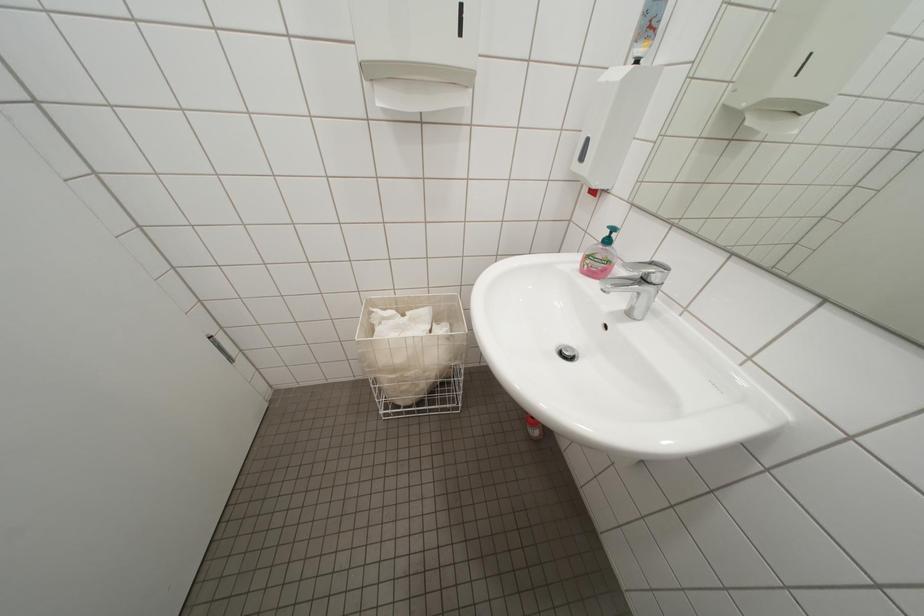
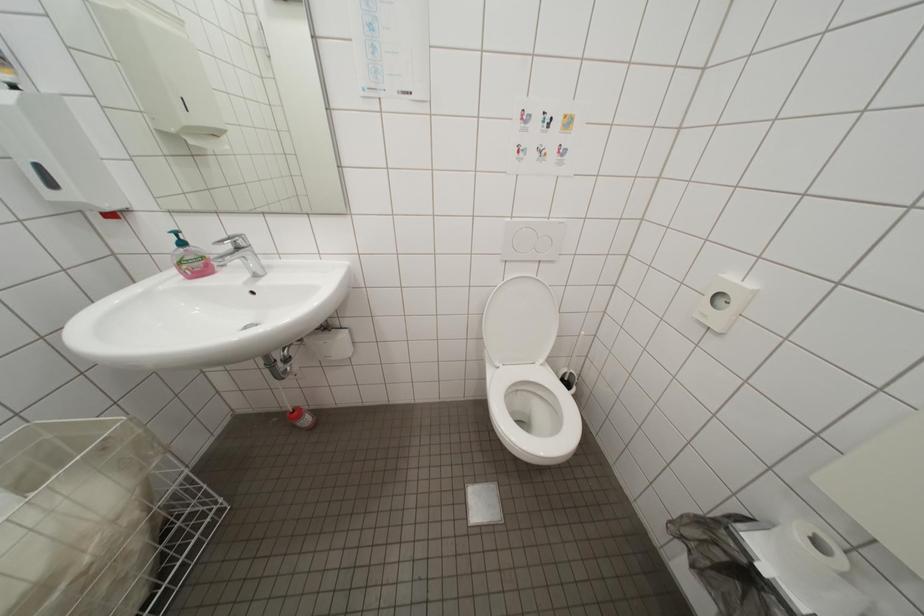
The images are taken continuously from a first-person perspective. In which direction is your viewpoint rotating?

The camera's rotation is toward right-down.